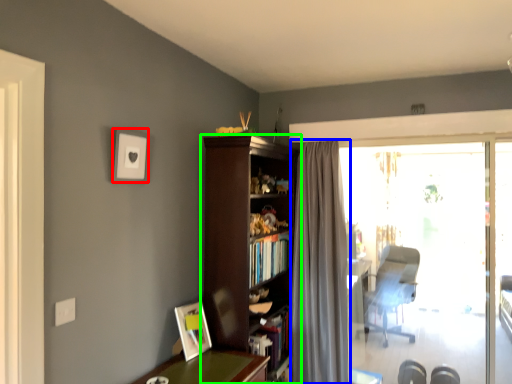
Question: Estimate the real-world distances between objects in this image. Which object is closer to picture frame (highlighted by a red box), curtain (highlighted by a blue box) or bookcase (highlighted by a green box)?

Choices:
 (A) curtain
 (B) bookcase

Answer: (B)